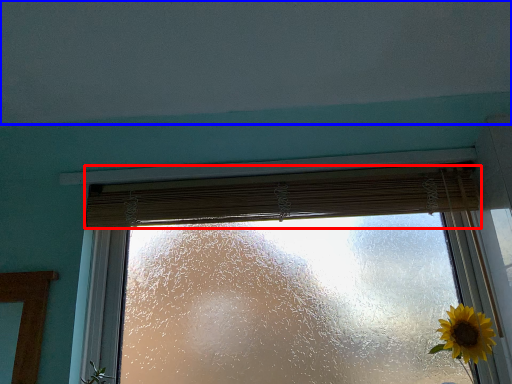
Question: Which object is further to the camera taking this photo, curtain (highlighted by a red box) or backdrop (highlighted by a blue box)?

Choices:
 (A) curtain
 (B) backdrop

Answer: (A)